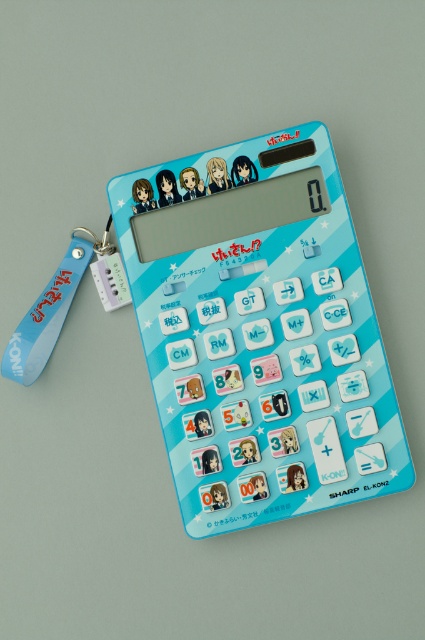
Question: Can you confirm if blue plastic calculator at center is positioned above blue rubber lanyard at lower left?

Choices:
 (A) yes
 (B) no

Answer: (B)

Question: Which point is farther from the camera taking this photo?

Choices:
 (A) (59, 289)
 (B) (283, 138)

Answer: (A)

Question: Among these objects, which one is farthest from the camera?

Choices:
 (A) blue plastic calculator at center
 (B) blue rubber lanyard at lower left

Answer: (B)

Question: Can you confirm if blue plastic calculator at center is positioned to the left of blue rubber lanyard at lower left?

Choices:
 (A) no
 (B) yes

Answer: (A)

Question: Can you confirm if blue plastic calculator at center is positioned to the right of blue rubber lanyard at lower left?

Choices:
 (A) yes
 (B) no

Answer: (A)

Question: Which of the following is the closest to the observer?

Choices:
 (A) blue rubber lanyard at lower left
 (B) blue plastic calculator at center

Answer: (B)